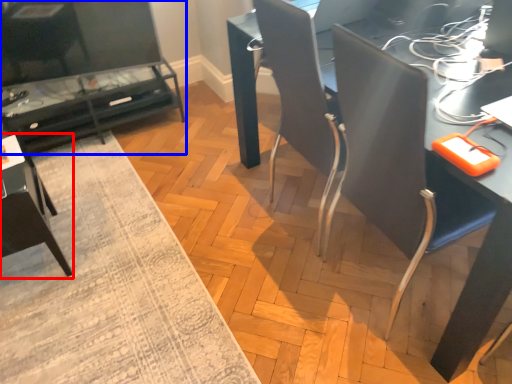
Question: Which object appears farthest to the camera in this image, armchair (highlighted by a red box) or table (highlighted by a blue box)?

Choices:
 (A) armchair
 (B) table

Answer: (B)